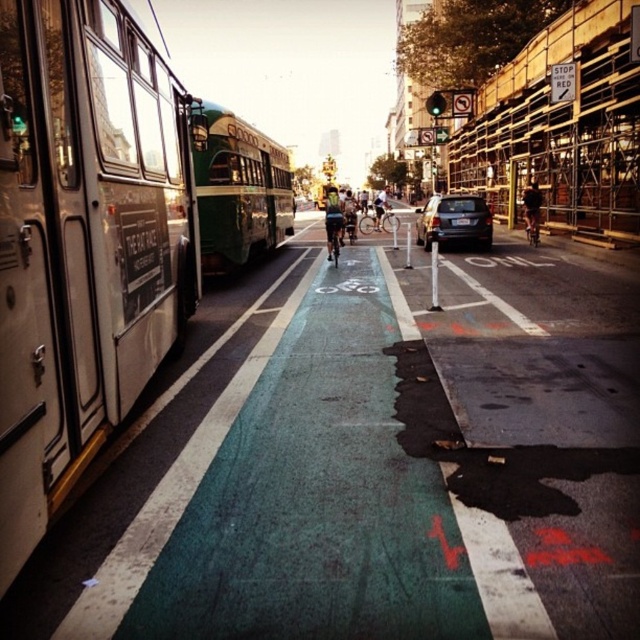
You are a delivery person who needs to cross the street to deliver a package. The green matte bus at center is blocking your path. Can you safely walk around the bus to reach the other side of the road without being hit by the green fabric bicycle at center?

The green matte bus at center and green fabric bicycle at center are 13.55 meters apart. Since the bus is blocking your path, you can walk around it, but you need to ensure that the green fabric bicycle at center is at a safe distance. However, the distance between them is 13.55 meters, so there is enough space to safely navigate around the bus while avoiding the bicycle.

You are a pedestrian trying to cross the street. You see a green matte bus at center and a green fabric bicycle at center. Which one is closer to you?

The green matte bus at center is closer to you because it is in front of the green fabric bicycle at center.

You are a pedestrian standing at the crosswalk and see the reflective silver bicycle at center approaching. The bus is 47.30 feet away from you. Can the bicycle reach you before the bus?

The reflective silver bicycle at center and the bus are 47.30 feet apart, so the bicycle can reach you before the bus since it is closer.